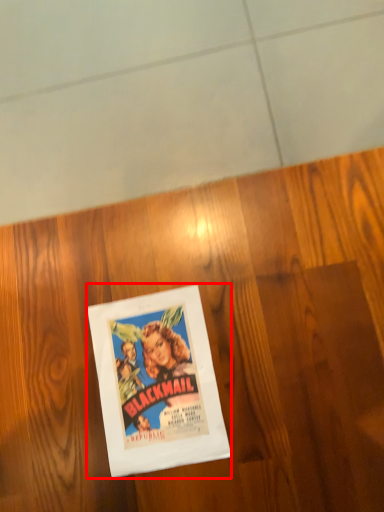
Question: Considering the relative positions of picture frame (annotated by the red box) and plywood in the image provided, where is picture frame (annotated by the red box) located with respect to the staircase?

Choices:
 (A) left
 (B) right

Answer: (A)